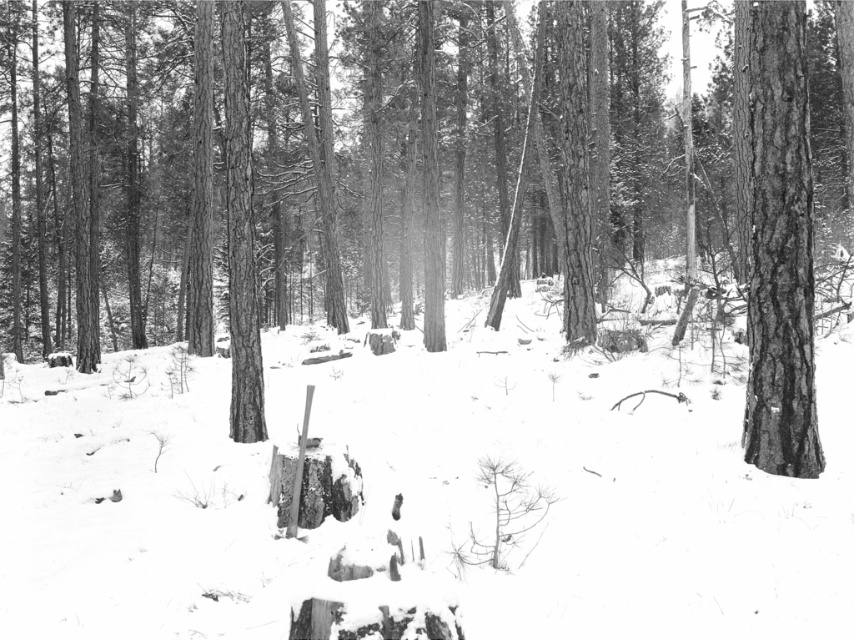
Question: Which object appears closest to the camera in this image?

Choices:
 (A) rough bark tree at center
 (B) smooth bark tree at right

Answer: (B)

Question: Which point is closer to the camera?

Choices:
 (A) rough bark tree at center
 (B) white powdery snow at center
 (C) smooth bark tree at right

Answer: (B)

Question: Is the position of rough bark tree at center more distant than that of smooth bark tree at right?

Choices:
 (A) yes
 (B) no

Answer: (A)

Question: Can you confirm if rough bark tree at center is smaller than white powdery snow at center?

Choices:
 (A) no
 (B) yes

Answer: (A)

Question: Can you confirm if rough bark tree at center is positioned to the right of smooth bark tree at right?

Choices:
 (A) yes
 (B) no

Answer: (B)

Question: Among these points, which one is farthest from the camera?

Choices:
 (A) (51, 202)
 (B) (804, 188)

Answer: (A)